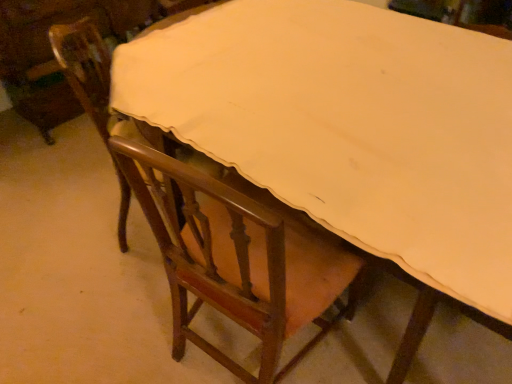
Question: Which direction should I rotate to face wooden chair at center, the second chair when ordered from left to right, — up or down?

Choices:
 (A) up
 (B) down

Answer: (B)

Question: Is wooden chair at center, the second chair when ordered from left to right, shorter than wooden chair at left, placed as the 1th chair when sorted from left to right?

Choices:
 (A) no
 (B) yes

Answer: (A)

Question: Is wooden chair at center, which is the first chair from right to left, further to camera compared to wooden chair at left, placed as the 1th chair when sorted from left to right?

Choices:
 (A) yes
 (B) no

Answer: (B)

Question: Considering the relative positions of wooden chair at center, which is the first chair from right to left, and wooden chair at left, placed as the 1th chair when sorted from left to right, in the image provided, is wooden chair at center, which is the first chair from right to left, to the left of wooden chair at left, placed as the 1th chair when sorted from left to right, from the viewer's perspective?

Choices:
 (A) yes
 (B) no

Answer: (B)

Question: Considering the relative sizes of wooden chair at center, which is the first chair from right to left, and wooden chair at left, placed as the 1th chair when sorted from left to right, in the image provided, is wooden chair at center, which is the first chair from right to left, bigger than wooden chair at left, placed as the 1th chair when sorted from left to right,?

Choices:
 (A) yes
 (B) no

Answer: (A)

Question: From a real-world perspective, is wooden chair at center, which is the first chair from right to left, on wooden chair at left, the 2th chair when ordered from right to left?

Choices:
 (A) yes
 (B) no

Answer: (A)

Question: From a real-world perspective, is wooden chair at center, the second chair when ordered from left to right, beneath wooden chair at left, placed as the 1th chair when sorted from left to right?

Choices:
 (A) yes
 (B) no

Answer: (B)

Question: Does wooden chair at left, the 2th chair when ordered from right to left, have a larger size compared to wooden chair at center, which is the first chair from right to left?

Choices:
 (A) yes
 (B) no

Answer: (B)

Question: Does wooden chair at left, placed as the 1th chair when sorted from left to right, have a lesser height compared to wooden chair at center, which is the first chair from right to left?

Choices:
 (A) yes
 (B) no

Answer: (A)

Question: From the image's perspective, is wooden chair at left, placed as the 1th chair when sorted from left to right, located above wooden chair at center, the second chair when ordered from left to right?

Choices:
 (A) no
 (B) yes

Answer: (B)

Question: Is wooden chair at left, placed as the 1th chair when sorted from left to right, positioned before wooden chair at center, which is the first chair from right to left?

Choices:
 (A) yes
 (B) no

Answer: (B)

Question: Is wooden chair at center, the second chair when ordered from left to right, inside wooden chair at left, the 2th chair when ordered from right to left?

Choices:
 (A) no
 (B) yes

Answer: (A)

Question: Could you tell me if wooden chair at left, placed as the 1th chair when sorted from left to right, is turned towards wooden chair at center, which is the first chair from right to left?

Choices:
 (A) yes
 (B) no

Answer: (B)

Question: Relative to wooden chair at center, which is the first chair from right to left, is wooden chair at left, placed as the 1th chair when sorted from left to right, in front or behind?

Choices:
 (A) front
 (B) behind

Answer: (B)